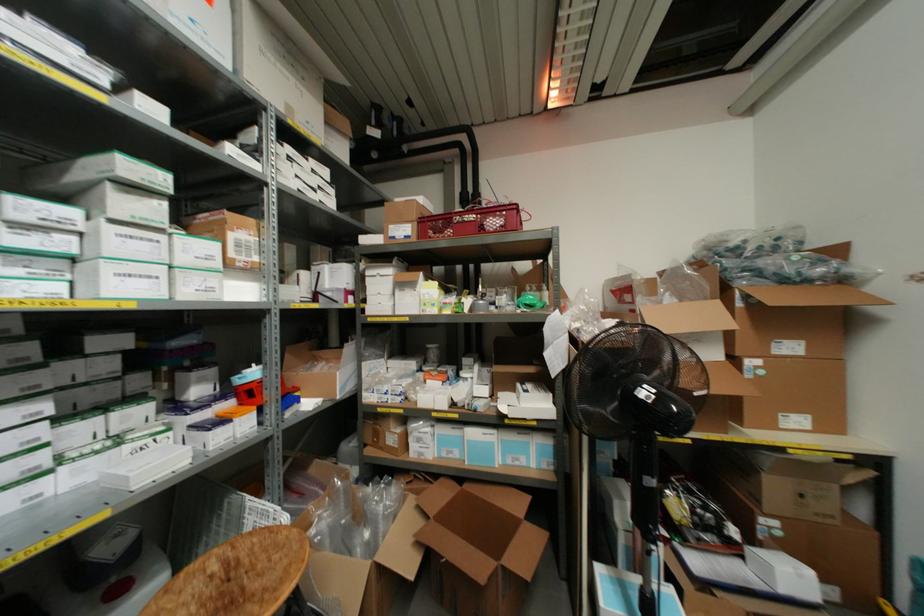
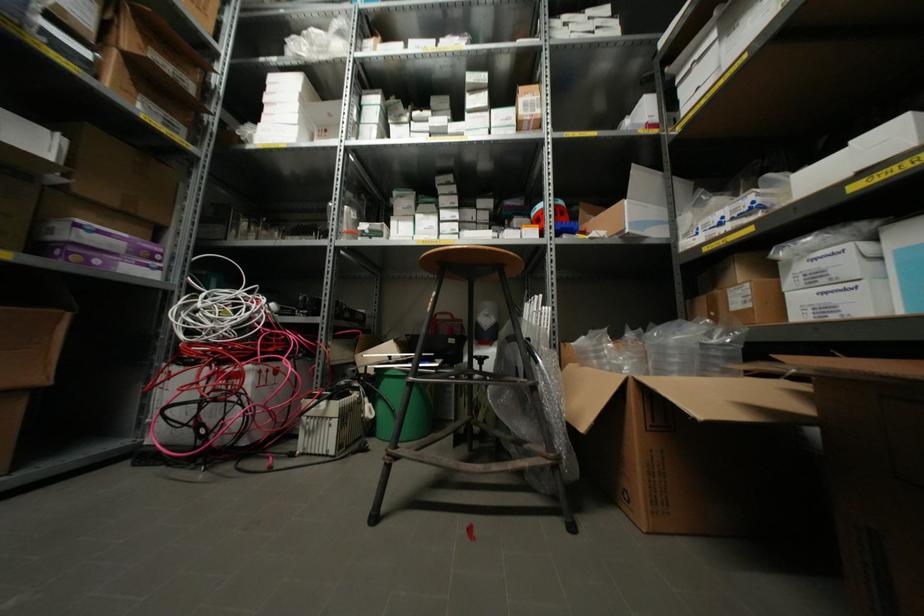
In the second image, find the point that corresponds to pixel 229 254 in the first image.

(519, 111)